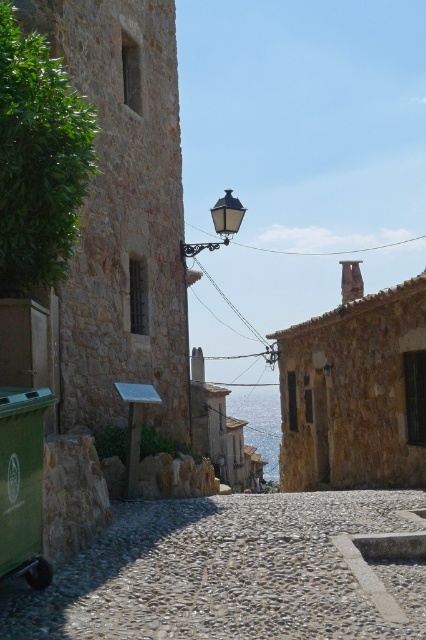
Question: Is the position of blue water at center more distant than that of black glass streetlamp at upper center?

Choices:
 (A) no
 (B) yes

Answer: (B)

Question: Is gray gravel alley at center above black glass streetlamp at upper center?

Choices:
 (A) no
 (B) yes

Answer: (A)

Question: Which point is closer to the camera taking this photo?

Choices:
 (A) (265, 496)
 (B) (253, 438)
 (C) (184, 246)

Answer: (A)

Question: Which of these objects is positioned closest to the blue water at center?

Choices:
 (A) gray gravel alley at center
 (B) black glass streetlamp at upper center

Answer: (A)

Question: Can you confirm if gray gravel alley at center is positioned to the right of blue water at center?

Choices:
 (A) no
 (B) yes

Answer: (A)

Question: Among these objects, which one is nearest to the camera?

Choices:
 (A) black glass streetlamp at upper center
 (B) blue water at center
 (C) gray gravel alley at center

Answer: (C)